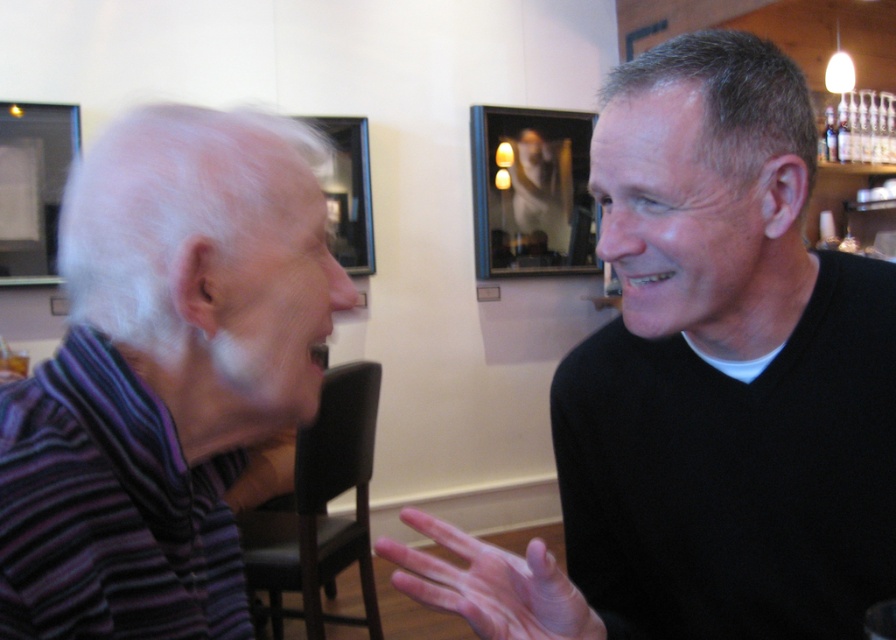
Question: Which point is farther to the camera?

Choices:
 (A) black matte sweater at center
 (B) purple striped sweater at left

Answer: (A)

Question: Which point appears closest to the camera in this image?

Choices:
 (A) (819, 349)
 (B) (304, 417)

Answer: (B)

Question: Is black matte sweater at center positioned before purple striped sweater at left?

Choices:
 (A) no
 (B) yes

Answer: (A)

Question: Which object appears farthest from the camera in this image?

Choices:
 (A) purple striped sweater at left
 (B) black matte sweater at center

Answer: (B)

Question: Does black matte sweater at center appear on the right side of purple striped sweater at left?

Choices:
 (A) yes
 (B) no

Answer: (A)

Question: Is black matte sweater at center bigger than purple striped sweater at left?

Choices:
 (A) yes
 (B) no

Answer: (A)